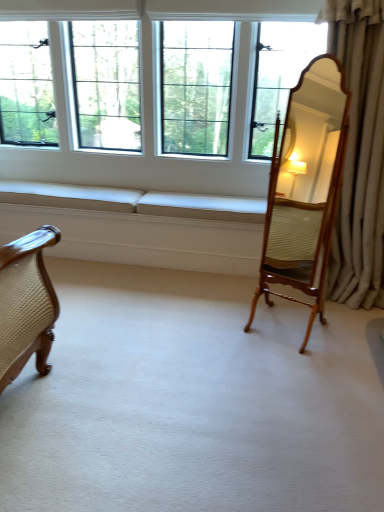
Question: From a real-world perspective, is silky beige curtain at right positioned above or below wooden mirror at right?

Choices:
 (A) above
 (B) below

Answer: (A)

Question: Based on their sizes in the image, would you say silky beige curtain at right is bigger or smaller than wooden mirror at right?

Choices:
 (A) small
 (B) big

Answer: (B)

Question: Estimate the real-world distances between objects in this image. Which object is farther from the clear glass windows at center?

Choices:
 (A) silky beige curtain at right
 (B) beige fabric couch at lower left
 (C) wooden mirror at right

Answer: (A)

Question: Which is farther from the silky beige curtain at right?

Choices:
 (A) clear glass windows at center
 (B) wooden mirror at right
 (C) beige fabric couch at lower left

Answer: (C)